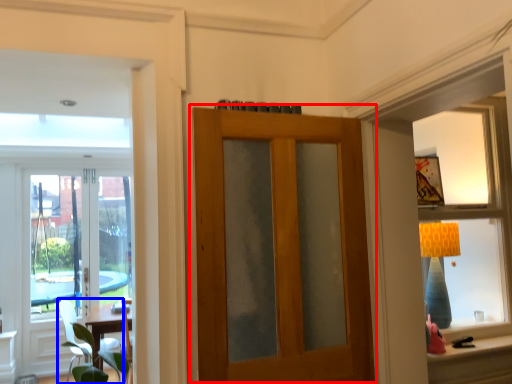
Question: Which object is closer to the camera taking this photo, door (highlighted by a red box) or chair (highlighted by a blue box)?

Choices:
 (A) door
 (B) chair

Answer: (A)